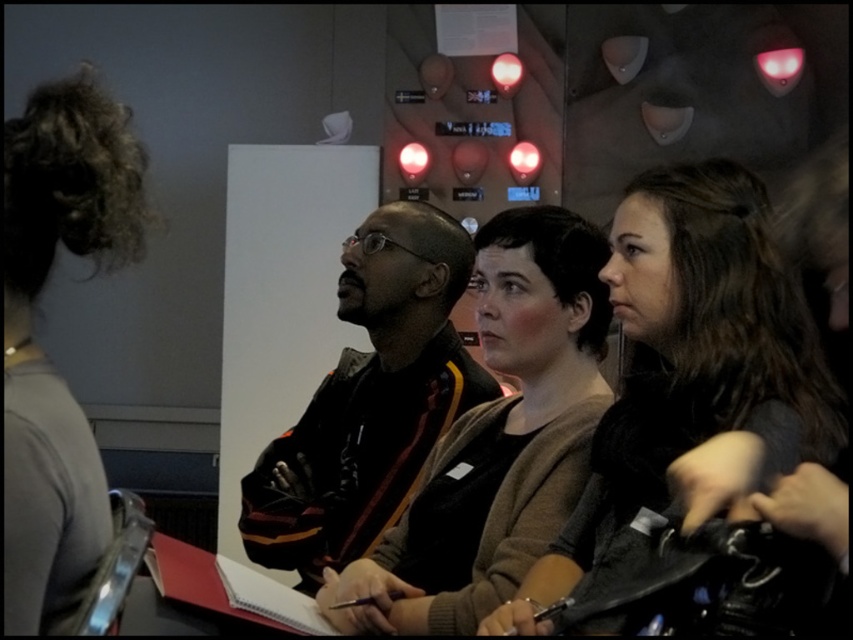
Question: Can you confirm if dark brown hair at center is positioned above dark brown leather jacket at center?

Choices:
 (A) no
 (B) yes

Answer: (B)

Question: From the image, what is the correct spatial relationship of dark brown hair at center in relation to matte black sweater at center?

Choices:
 (A) left
 (B) right

Answer: (B)

Question: Which of the following is the closest to the observer?

Choices:
 (A) (663, 484)
 (B) (450, 540)

Answer: (A)

Question: Among these points, which one is nearest to the camera?

Choices:
 (A) (695, 406)
 (B) (379, 352)
 (C) (548, 394)

Answer: (A)

Question: Which point appears closest to the camera in this image?

Choices:
 (A) (399, 588)
 (B) (773, 289)

Answer: (B)

Question: Observing the image, what is the correct spatial positioning of dark brown hair at center in reference to matte black sweater at center?

Choices:
 (A) left
 (B) right

Answer: (B)